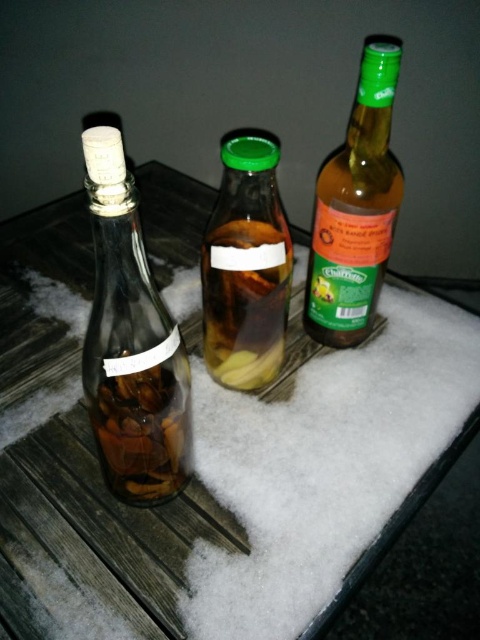
Question: Does green glass bottle at right appear over translucent glass bottle at center?

Choices:
 (A) yes
 (B) no

Answer: (A)

Question: Among these objects, which one is nearest to the camera?

Choices:
 (A) clear glass bottle at left
 (B) translucent glass bottle at center

Answer: (A)

Question: Is clear glass bottle at left positioned in front of green glass bottle at right?

Choices:
 (A) yes
 (B) no

Answer: (A)

Question: Which point is farther to the camera?

Choices:
 (A) translucent glass bottle at center
 (B) clear glass bottle at left
 (C) green glass bottle at right

Answer: (C)

Question: Does clear glass bottle at left appear under green glass bottle at right?

Choices:
 (A) no
 (B) yes

Answer: (B)

Question: Among these objects, which one is farthest from the camera?

Choices:
 (A) green glass bottle at right
 (B) clear glass bottle at left
 (C) translucent glass bottle at center

Answer: (A)